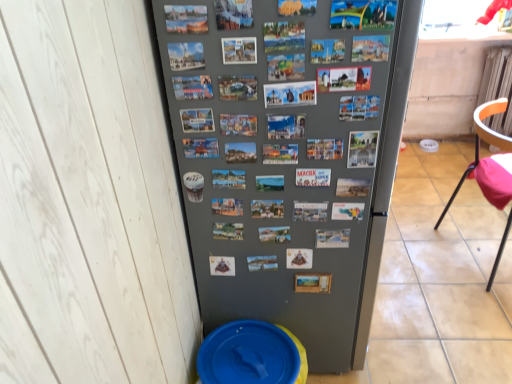
Question: Looking at the image, does blue plastic potty at lower left seem bigger or smaller compared to orange plastic chair at right?

Choices:
 (A) big
 (B) small

Answer: (B)

Question: From the image's perspective, relative to orange plastic chair at right, is blue plastic potty at lower left above or below?

Choices:
 (A) below
 (B) above

Answer: (A)

Question: Which object is the closest to the orange plastic chair at right?

Choices:
 (A) gray matte refrigerator at center
 (B) blue plastic potty at lower left

Answer: (A)

Question: Which object is positioned closest to the orange plastic chair at right?

Choices:
 (A) blue plastic potty at lower left
 (B) gray matte refrigerator at center

Answer: (B)